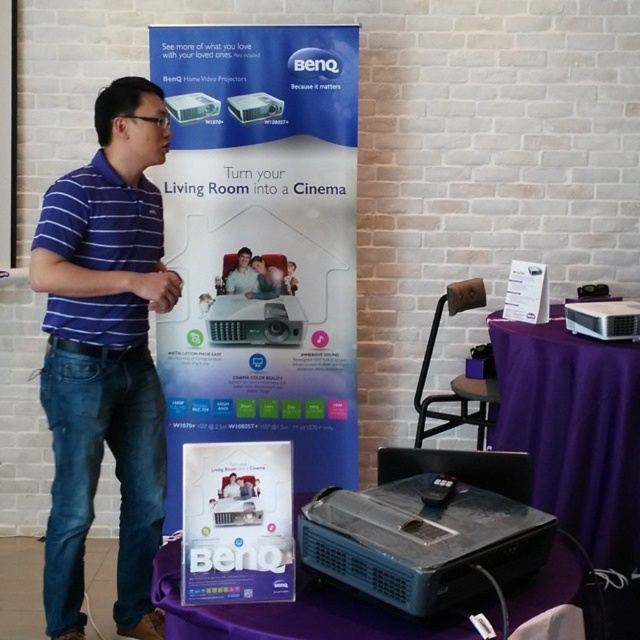
Does blue striped polo shirt at center appear on the right side of black plastic game controller at lower center?

No, blue striped polo shirt at center is not to the right of black plastic game controller at lower center.

Who is positioned more to the right, blue striped polo shirt at center or black plastic game controller at lower center?

black plastic game controller at lower center is more to the right.

The width and height of the screenshot is (640, 640). I want to click on blue striped polo shirt at center, so click(106, 355).

Is the position of blue striped polo shirt at center less distant than that of wooden speaker at center?

That is True.

Does blue striped polo shirt at center have a lesser width compared to wooden speaker at center?

No, blue striped polo shirt at center is not thinner than wooden speaker at center.

Identify the location of blue striped polo shirt at center. This screenshot has width=640, height=640. (106, 355).

At what (x,y) coordinates should I click in order to perform the action: click on blue striped polo shirt at center. Please return your answer as a coordinate pair (x, y). This screenshot has width=640, height=640. Looking at the image, I should click on (106, 355).

Is the position of matte white shirt at center more distant than that of matte black projector at center?

Yes.

How much distance is there between matte white shirt at center and matte black projector at center?

matte white shirt at center is 6.54 inches from matte black projector at center.

Locate an element on the screen. Image resolution: width=640 pixels, height=640 pixels. matte white shirt at center is located at coordinates (243, 276).